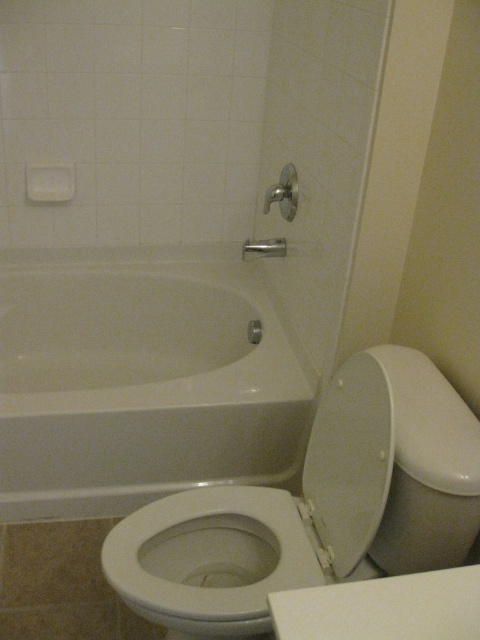
You are a plumber inspecting the bathroom layout. You need to access the water valve for the white glossy bathtub at center. The valve is located behind it. Can you easily reach the valve if the white glossy toilet at lower right is blocking the area?

The white glossy toilet at lower right is behind the white glossy bathtub at center, so it is blocking access to the valve. You cannot easily reach the valve.

You are a plumber checking the bathroom fixtures. You need to determine which object is bigger between the white glossy toilet at lower right and the matte silver shower handle at upper center. Which one is larger?

The white glossy toilet at lower right is larger than the matte silver shower handle at upper center according to the description.